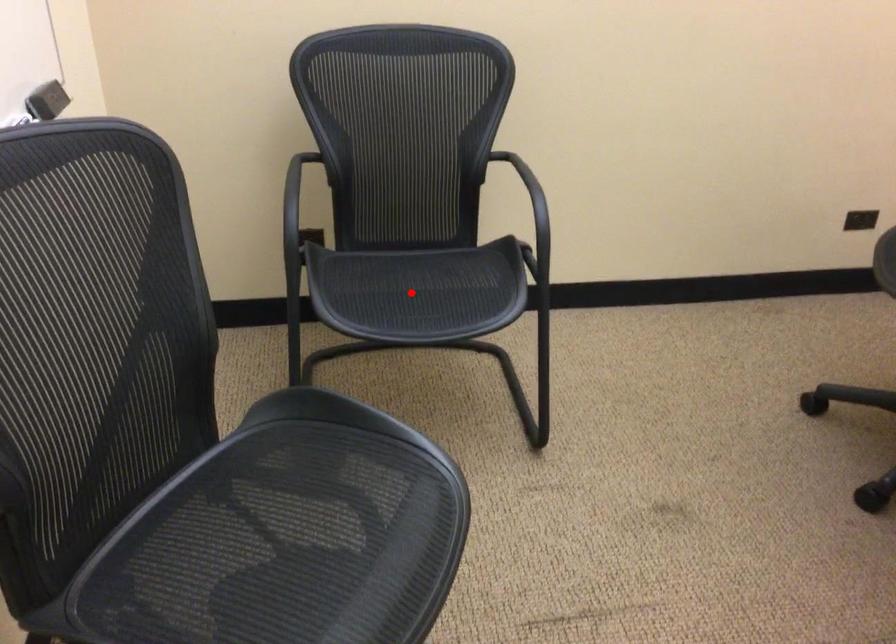
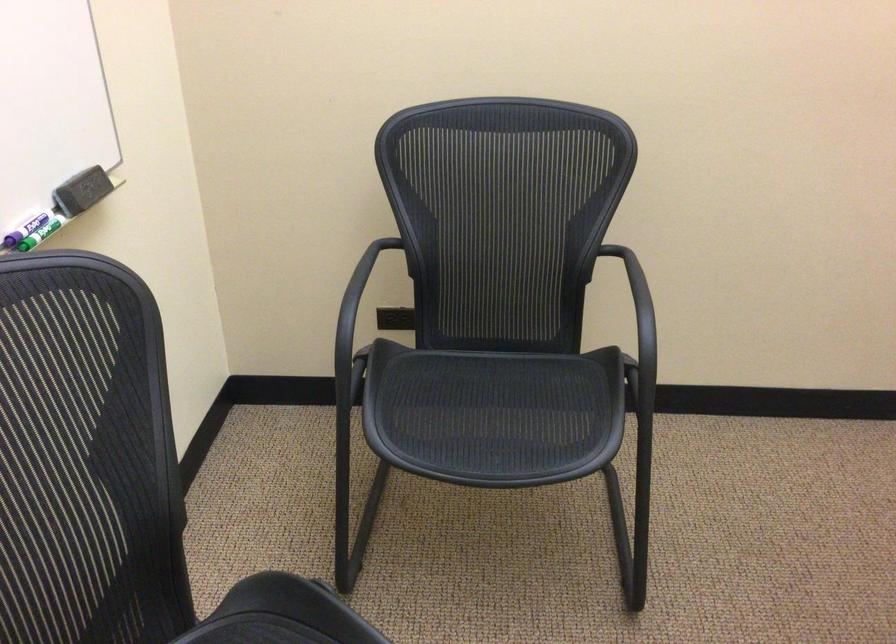
Locate, in the second image, the point that corresponds to the highlighted location in the first image.

(478, 413)